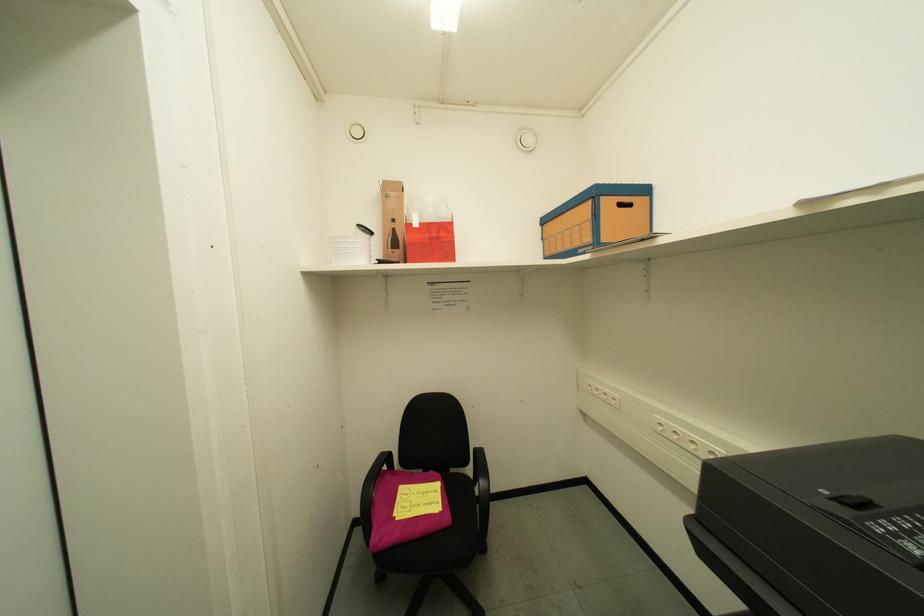
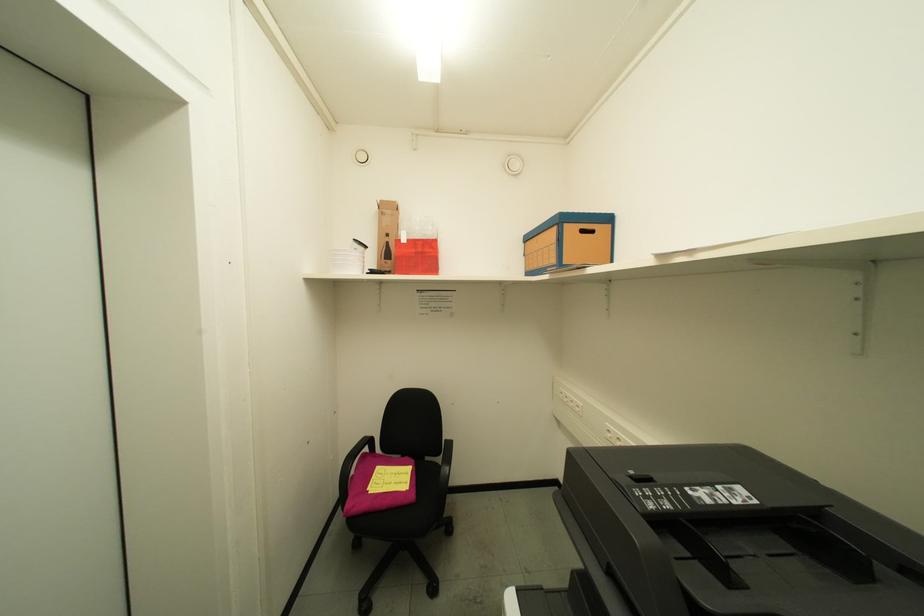
Question: Based on the continuous images, in which direction is the camera rotating? Reply with the corresponding letter.

Choices:
 (A) Left
 (B) Right
 (C) Up
 (D) Down

Answer: (A)